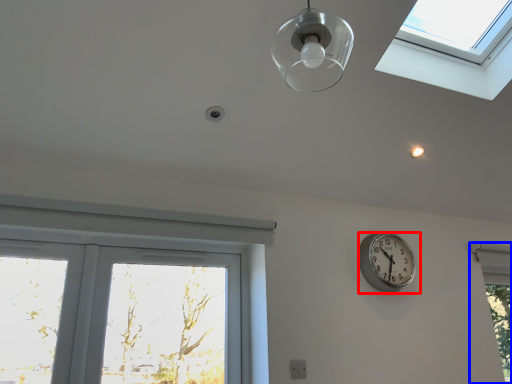
Question: Which object appears farthest to the camera in this image, wall clock (highlighted by a red box) or window (highlighted by a blue box)?

Choices:
 (A) wall clock
 (B) window

Answer: (B)